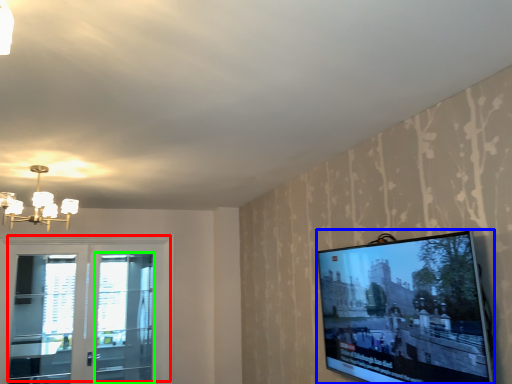
Question: Which object is positioned farthest from window (highlighted by a red box)? Select from television (highlighted by a blue box) and screen door (highlighted by a green box).

Choices:
 (A) television
 (B) screen door

Answer: (A)